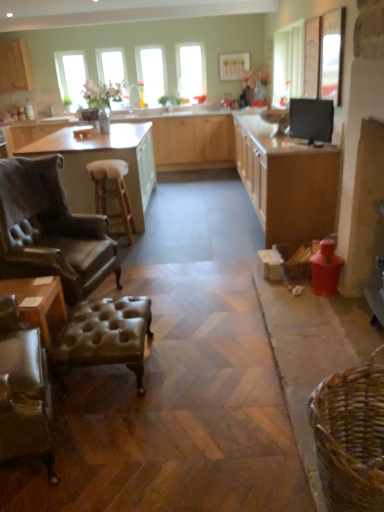
Question: Is point (79, 75) closer or farther from the camera than point (62, 122)?

Choices:
 (A) farther
 (B) closer

Answer: (A)

Question: Considering the positions of clear glass window at upper left, placed as the 1th window when sorted from left to right, and matte wood countertop at center in the image, is clear glass window at upper left, placed as the 1th window when sorted from left to right, wider or thinner than matte wood countertop at center?

Choices:
 (A) wide
 (B) thin

Answer: (B)

Question: Estimate the real-world distances between objects in this image. Which object is closer to the white leather stool at center?

Choices:
 (A) clear glass window at upper center
 (B) clear glass window at upper left, placed as the 1th window when sorted from left to right
 (C) black glossy monitor at upper right
 (D) clear glass window at center, which ranks as the 2th window in right-to-left order
 (E) matte wood cabinetry at center, the 2th cabinetry when ordered from right to left

Answer: (C)

Question: Considering the real-world distances, which object is farthest from the brown leather table at left, the 1th table positioned from the top?

Choices:
 (A) leather armchair at left
 (B) matte wood cabinet at upper left, which is counted as the 1th cabinetry, starting from the left
 (C) clear glass window at upper center, which is counted as the third window, starting from the left
 (D) matte wood countertop at center
 (E) clear glass window at upper left, the third window viewed from the right

Answer: (B)